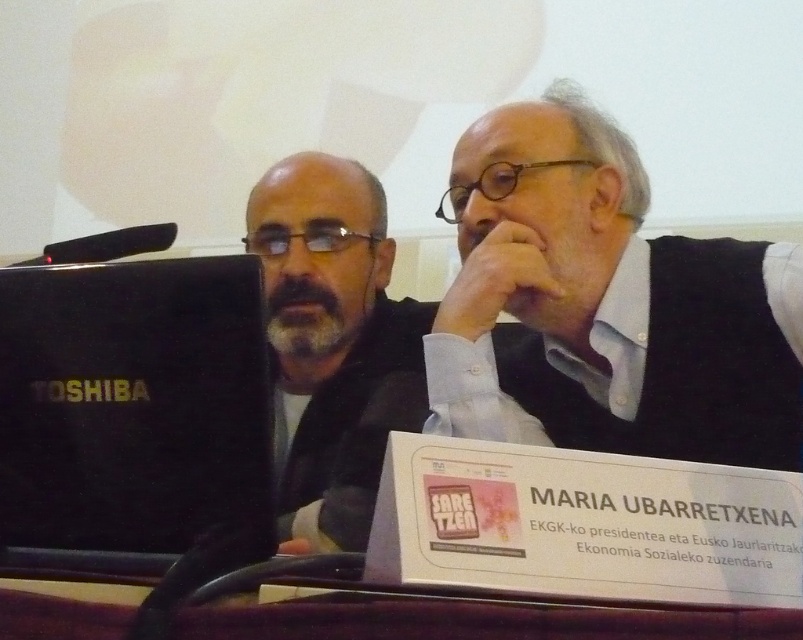
Is matte black laptop at left smaller than gray beard at center?

Actually, matte black laptop at left might be larger than gray beard at center.

Consider the image. Is matte black laptop at left closer to camera compared to gray beard at center?

Yes, it is in front of gray beard at center.

This screenshot has width=803, height=640. In order to click on matte black laptop at left in this screenshot , I will do `click(333, 342)`.

At what (x,y) coordinates should I click in order to perform the action: click on matte black laptop at left. Please return your answer as a coordinate pair (x, y). This screenshot has width=803, height=640. Looking at the image, I should click on (333, 342).

Is point (53, 557) positioned before point (369, 376)?

Yes, it is.

I want to click on black matte laptop at left, so click(131, 412).

Does point (251, 326) lie behind point (286, 506)?

No, it is in front of (286, 506).

Where is `black matte laptop at left`? The height and width of the screenshot is (640, 803). black matte laptop at left is located at coordinates (131, 412).

Does black matte laptop at left have a smaller size compared to gray beard at center?

Actually, black matte laptop at left might be larger than gray beard at center.

Does black matte laptop at left appear under gray beard at center?

Correct, black matte laptop at left is located below gray beard at center.

Is point (100, 371) more distant than point (288, 314)?

No, (100, 371) is closer to viewer.

The width and height of the screenshot is (803, 640). What are the coordinates of `black matte laptop at left` in the screenshot? It's located at (131, 412).